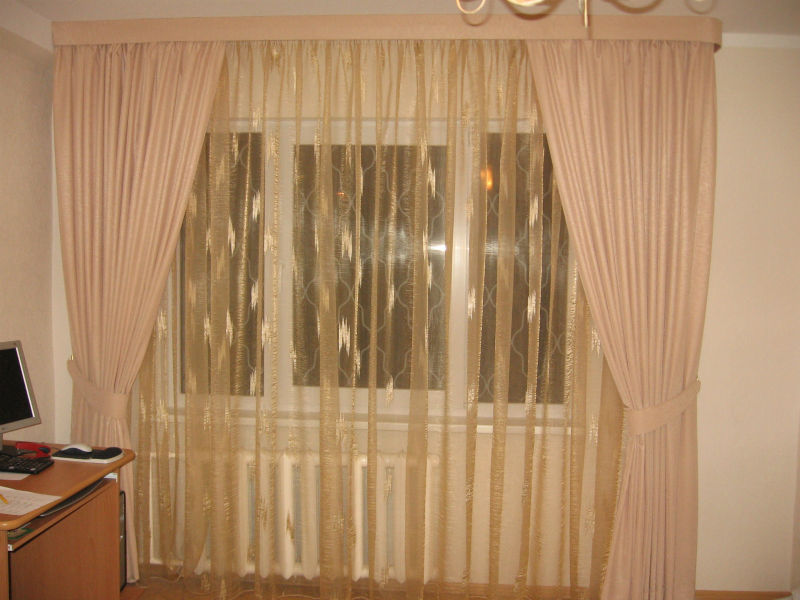
This screenshot has width=800, height=600. Identify the location of light pink walls. (766, 342), (8, 108).